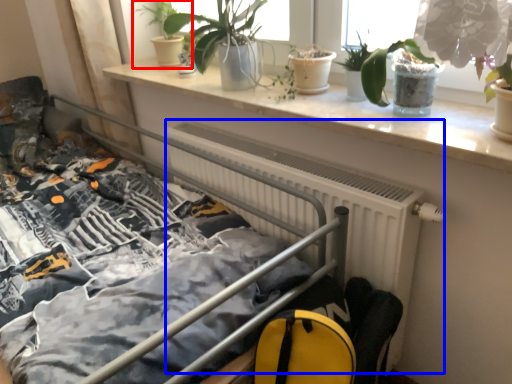
Question: Among these objects, which one is farthest to the camera, houseplant (highlighted by a red box) or radiator (highlighted by a blue box)?

Choices:
 (A) houseplant
 (B) radiator

Answer: (A)